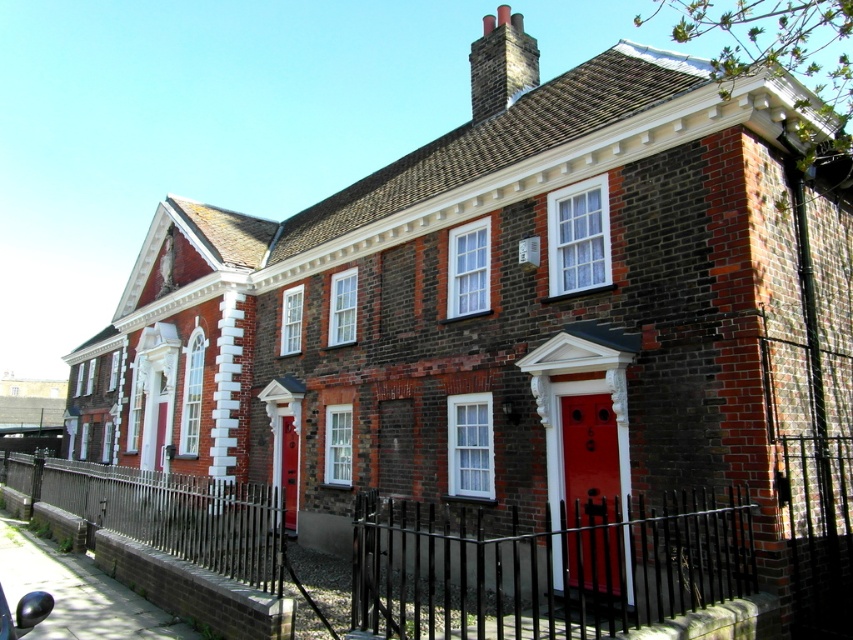
Between black metal fence at lower center and matte red door at center, which one has more height?

black metal fence at lower center

The width and height of the screenshot is (853, 640). What are the coordinates of `black metal fence at lower center` in the screenshot? It's located at (544, 564).

Which is in front, point (13, 484) or point (296, 502)?

Positioned in front is point (296, 502).

This screenshot has width=853, height=640. Identify the location of black metal fence at lower center. (544, 564).

Describe the element at coordinates (544, 564) in the screenshot. The image size is (853, 640). I see `black metal fence at lower center` at that location.

Can you confirm if black metal fence at lower center is thinner than smooth glossy red door at center?

Incorrect, black metal fence at lower center's width is not less than smooth glossy red door at center's.

Find the location of a particular element. The height and width of the screenshot is (640, 853). black metal fence at lower center is located at coordinates click(544, 564).

Who is taller, smooth glossy red door at center or matte red door at center?

smooth glossy red door at center

Is point (583, 509) closer to camera compared to point (289, 464)?

Yes, it is.

Does point (585, 564) lie in front of point (283, 436)?

Yes, point (585, 564) is in front of point (283, 436).

The image size is (853, 640). I want to click on smooth glossy red door at center, so click(590, 492).